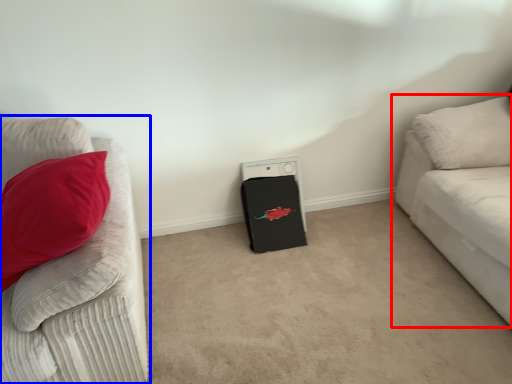
Question: Among these objects, which one is farthest to the camera, studio couch (highlighted by a red box) or studio couch (highlighted by a blue box)?

Choices:
 (A) studio couch
 (B) studio couch

Answer: (A)